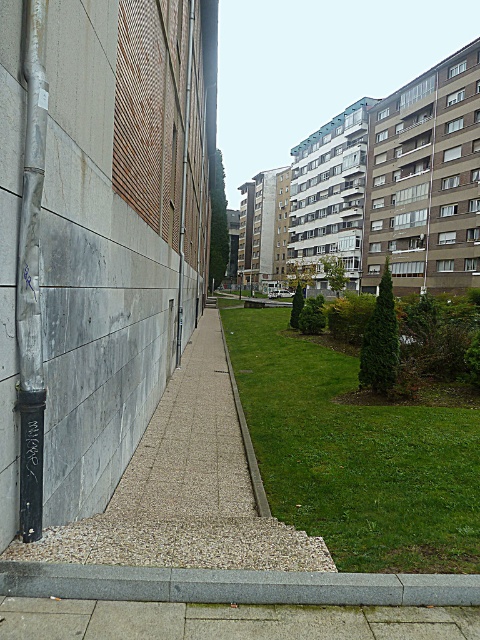
Looking at this image, does smooth concrete path at center appear on the right side of gray concrete pavement at lower center?

In fact, smooth concrete path at center is to the left of gray concrete pavement at lower center.

Is smooth concrete path at center taller than gray concrete pavement at lower center?

Yes, smooth concrete path at center is taller than gray concrete pavement at lower center.

What do you see at coordinates (184, 488) in the screenshot?
I see `smooth concrete path at center` at bounding box center [184, 488].

This screenshot has width=480, height=640. In order to click on smooth concrete path at center in this screenshot , I will do `click(184, 488)`.

Can you confirm if green grass at center is shorter than gray concrete pavement at lower center?

In fact, green grass at center may be taller than gray concrete pavement at lower center.

Looking at this image, does green grass at center have a lesser width compared to gray concrete pavement at lower center?

Incorrect, green grass at center's width is not less than gray concrete pavement at lower center's.

Is point (279, 515) less distant than point (156, 611)?

No, it is behind (156, 611).

Where is `green grass at center`? Image resolution: width=480 pixels, height=640 pixels. green grass at center is located at coordinates 355,454.

Can you confirm if green grass at center is positioned below gray gravel at lower center?

Actually, green grass at center is above gray gravel at lower center.

Looking at this image, can you confirm if green grass at center is thinner than gray gravel at lower center?

No.

You are a GUI agent. You are given a task and a screenshot of the screen. Output one action in this format:
    pyautogui.click(x=<x>, y=<y>)
    Task: Click on the green grass at center
    
    Given the screenshot: What is the action you would take?
    pyautogui.click(x=355, y=454)